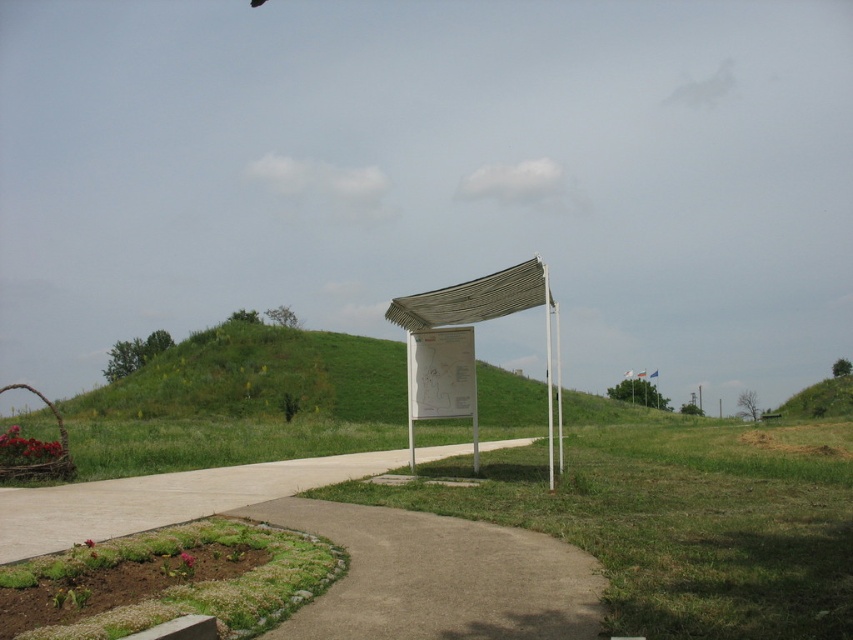
Is gray concrete pavement at lower center to the right of white textured canopy at center from the viewer's perspective?

No, gray concrete pavement at lower center is not to the right of white textured canopy at center.

Is gray concrete pavement at lower center thinner than white textured canopy at center?

Yes.

Locate an element on the screen. The width and height of the screenshot is (853, 640). gray concrete pavement at lower center is located at coordinates 437,577.

Which is more to the left, gray concrete pavement at lower center or white paper sign at center?

white paper sign at center

Image resolution: width=853 pixels, height=640 pixels. Describe the element at coordinates (437, 577) in the screenshot. I see `gray concrete pavement at lower center` at that location.

Is point (380, 609) less distant than point (410, 384)?

Yes.

This screenshot has height=640, width=853. Identify the location of gray concrete pavement at lower center. (437, 577).

Who is more distant from viewer, (291, 493) or (511, 276)?

The point (511, 276) is behind.

Does light gray concrete pavement at lower left lie in front of white textured canopy at center?

That is True.

Which is in front, point (248, 465) or point (460, 305)?

Positioned in front is point (460, 305).

At what (x,y) coordinates should I click in order to perform the action: click on light gray concrete pavement at lower left. Please return your answer as a coordinate pair (x, y). Image resolution: width=853 pixels, height=640 pixels. Looking at the image, I should click on (161, 499).